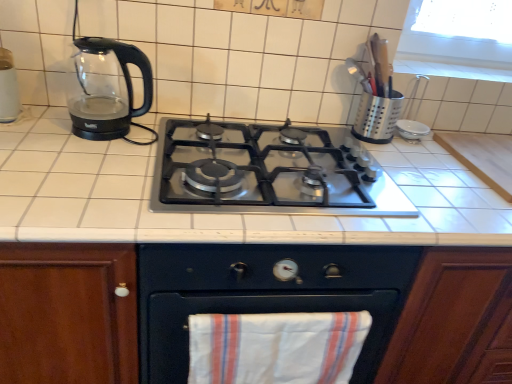
Looking at this image, what is the approximate height of transparent glass kettle at left?

9.89 inches.

What do you see at coordinates (106, 88) in the screenshot?
I see `transparent glass kettle at left` at bounding box center [106, 88].

The height and width of the screenshot is (384, 512). What do you see at coordinates (222, 206) in the screenshot?
I see `white tile countertop at center` at bounding box center [222, 206].

Locate an element on the screen. The height and width of the screenshot is (384, 512). silver metallic utensil holder at upper right is located at coordinates (377, 117).

From a real-world perspective, is white tile countertop at center located higher than transparent glass kettle at left?

No, from a real-world perspective, white tile countertop at center is not above transparent glass kettle at left.

Considering the relative positions of white tile countertop at center and transparent glass kettle at left in the image provided, is white tile countertop at center to the left of transparent glass kettle at left from the viewer's perspective?

Incorrect, white tile countertop at center is not on the left side of transparent glass kettle at left.

From the picture: Who is bigger, white tile countertop at center or transparent glass kettle at left?

Bigger between the two is white tile countertop at center.

Is white tile countertop at center taller or shorter than transparent glass kettle at left?

Considering their sizes, white tile countertop at center has more height than transparent glass kettle at left.

Can you tell me how much transparent glass kettle at left and wooden cabinet at center differ in facing direction?

transparent glass kettle at left and wooden cabinet at center are facing 0.000865 degrees away from each other.

Which of these two, transparent glass kettle at left or wooden cabinet at center, is thinner?

transparent glass kettle at left.

Can you confirm if transparent glass kettle at left is shorter than wooden cabinet at center?

Correct, transparent glass kettle at left is not as tall as wooden cabinet at center.

Is transparent glass kettle at left touching wooden cabinet at center?

No, transparent glass kettle at left is not beside wooden cabinet at center.

Which point is more forward, (138, 173) or (174, 131)?

The point (138, 173) is more forward.

Considering the sizes of objects white tile countertop at center and black glass gas stove at center in the image provided, who is smaller, white tile countertop at center or black glass gas stove at center?

With smaller size is black glass gas stove at center.

Is white tile countertop at center turned away from black glass gas stove at center?

white tile countertop at center does not have its back to black glass gas stove at center.

Which object is positioned more to the right, white tile countertop at center or black glass gas stove at center?

Positioned to the right is white tile countertop at center.

Is black glass gas stove at center not near white cotton beach towel at lower center?

black glass gas stove at center is near white cotton beach towel at lower center, not far away.

Is point (236, 188) closer or farther from the camera than point (287, 319)?

Point (236, 188) appears to be farther away from the viewer than point (287, 319).

Is black glass gas stove at center turned away from white cotton beach towel at lower center?

No, black glass gas stove at center is not facing away from white cotton beach towel at lower center.

From the image's perspective, is wooden cabinet at center above or below silver metallic utensil holder at upper right?

From the image's perspective, wooden cabinet at center appears below silver metallic utensil holder at upper right.

Is wooden cabinet at center touching silver metallic utensil holder at upper right?

wooden cabinet at center and silver metallic utensil holder at upper right are not in contact.

How different are the orientations of wooden cabinet at center and silver metallic utensil holder at upper right in degrees?

wooden cabinet at center and silver metallic utensil holder at upper right are facing 0.00191 degrees away from each other.

Locate an element on the screen. This screenshot has height=384, width=512. cabinetry below the silver metallic utensil holder at upper right (from a real-world perspective) is located at coordinates (249, 307).

Can you see white tile countertop at center touching wooden cabinet at center?

white tile countertop at center and wooden cabinet at center are not in contact.

Is white tile countertop at center aimed at wooden cabinet at center?

Yes, white tile countertop at center is facing wooden cabinet at center.

Considering the relative positions of white tile countertop at center and wooden cabinet at center in the image provided, is white tile countertop at center to the left of wooden cabinet at center from the viewer's perspective?

Correct, you'll find white tile countertop at center to the left of wooden cabinet at center.

Is white tile countertop at center situated inside wooden cabinet at center or outside?

white tile countertop at center lies within the bounds of wooden cabinet at center.

How many degrees apart are the facing directions of black glass gas stove at center and transparent glass kettle at left?

0.00053 degrees.

Consider the image. Between black glass gas stove at center and transparent glass kettle at left, which one has larger width?

With larger width is black glass gas stove at center.

Consider the image. Is black glass gas stove at center taller than transparent glass kettle at left?

Incorrect, the height of black glass gas stove at center is not larger of that of transparent glass kettle at left.

Is black glass gas stove at center further to the viewer compared to transparent glass kettle at left?

No, black glass gas stove at center is closer to the viewer.

The image size is (512, 384). What are the coordinates of `kitchen appliance on the left side of white tile countertop at center` in the screenshot? It's located at (106, 88).

You are a GUI agent. You are given a task and a screenshot of the screen. Output one action in this format:
    pyautogui.click(x=<x>, y=<y>)
    Task: Click on the cabinetry in front of the transparent glass kettle at left
    This screenshot has height=384, width=512.
    Given the screenshot: What is the action you would take?
    pyautogui.click(x=249, y=307)

Looking at this image, estimate the real-world distances between objects in this image. Which object is further from transparent glass kettle at left, white tile countertop at center or silver metallic utensil holder at upper right?

The object further to transparent glass kettle at left is silver metallic utensil holder at upper right.

Looking at the image, which one is located closer to white cotton beach towel at lower center, wooden cabinet at center or transparent glass kettle at left?

Based on the image, wooden cabinet at center appears to be nearer to white cotton beach towel at lower center.

From the image, which object appears to be nearer to black glass gas stove at center, white cotton beach towel at lower center or white tile countertop at center?

white tile countertop at center is positioned closer to the anchor black glass gas stove at center.

From the image, which object appears to be farther from black glass gas stove at center, wooden cabinet at center or transparent glass kettle at left?

transparent glass kettle at left.

Based on their spatial positions, is silver metallic utensil holder at upper right or black glass gas stove at center further from transparent glass kettle at left?

Among the two, silver metallic utensil holder at upper right is located further to transparent glass kettle at left.

From the image, which object appears to be nearer to silver metallic utensil holder at upper right, transparent glass kettle at left or wooden cabinet at center?

The object closer to silver metallic utensil holder at upper right is wooden cabinet at center.

Estimate the real-world distances between objects in this image. Which object is closer to white cotton beach towel at lower center, silver metallic utensil holder at upper right or transparent glass kettle at left?

transparent glass kettle at left lies closer to white cotton beach towel at lower center than the other object.

Considering their positions, is white tile countertop at center positioned closer to silver metallic utensil holder at upper right than white cotton beach towel at lower center?

Based on the image, white tile countertop at center appears to be nearer to silver metallic utensil holder at upper right.

Locate an element on the screen. gas stove between wooden cabinet at center and silver metallic utensil holder at upper right in the front-back direction is located at coordinates (266, 173).

The width and height of the screenshot is (512, 384). I want to click on gas stove between transparent glass kettle at left and wooden cabinet at center in the vertical direction, so click(x=266, y=173).

The width and height of the screenshot is (512, 384). Identify the location of gas stove between transparent glass kettle at left and white cotton beach towel at lower center in the vertical direction. [266, 173].

Find the location of a particular element. beach towel between black glass gas stove at center and wooden cabinet at center vertically is located at coordinates (276, 347).